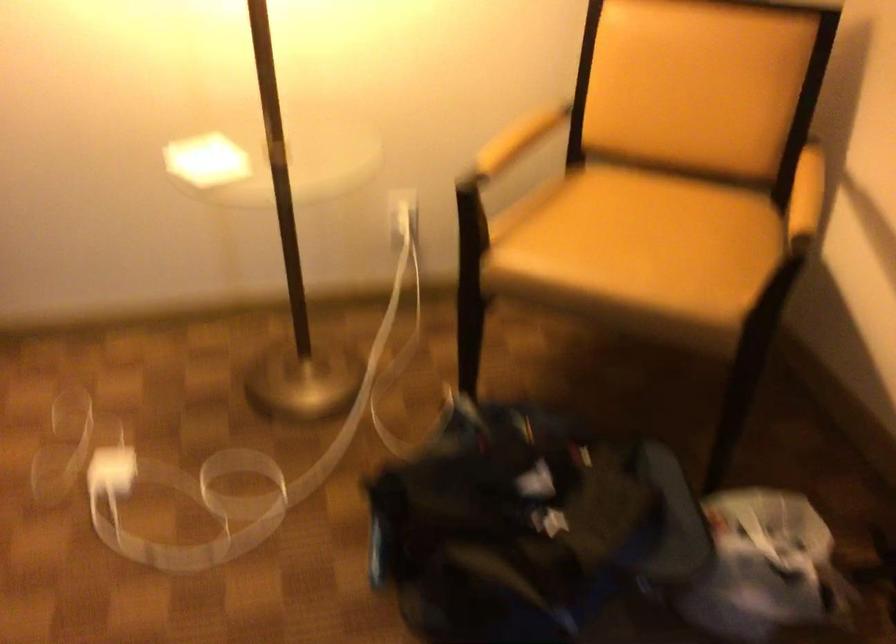
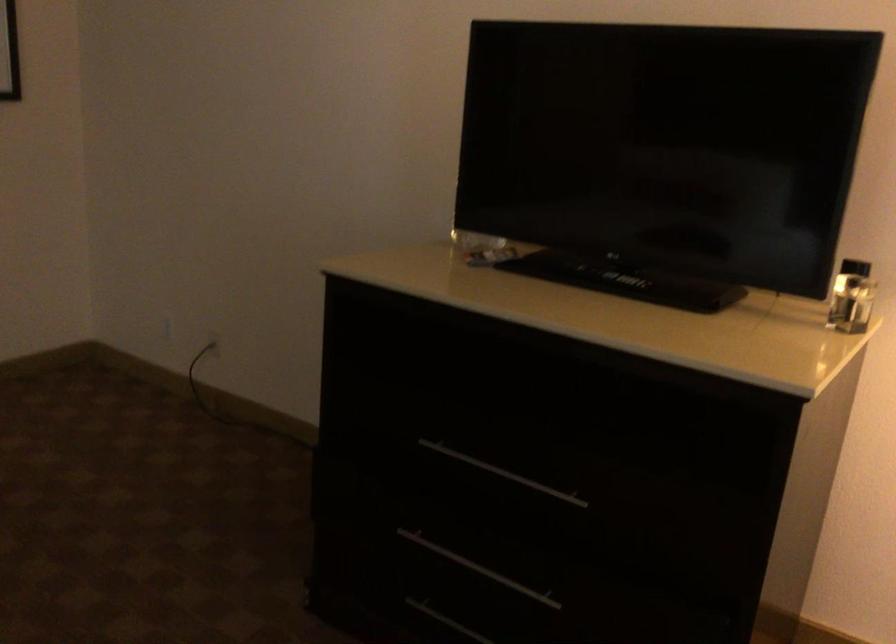
Question: Based on the continuous images, in which direction is the camera rotating? Reply with the corresponding letter.

Choices:
 (A) Left
 (B) Right
 (C) Up
 (D) Down

Answer: (A)